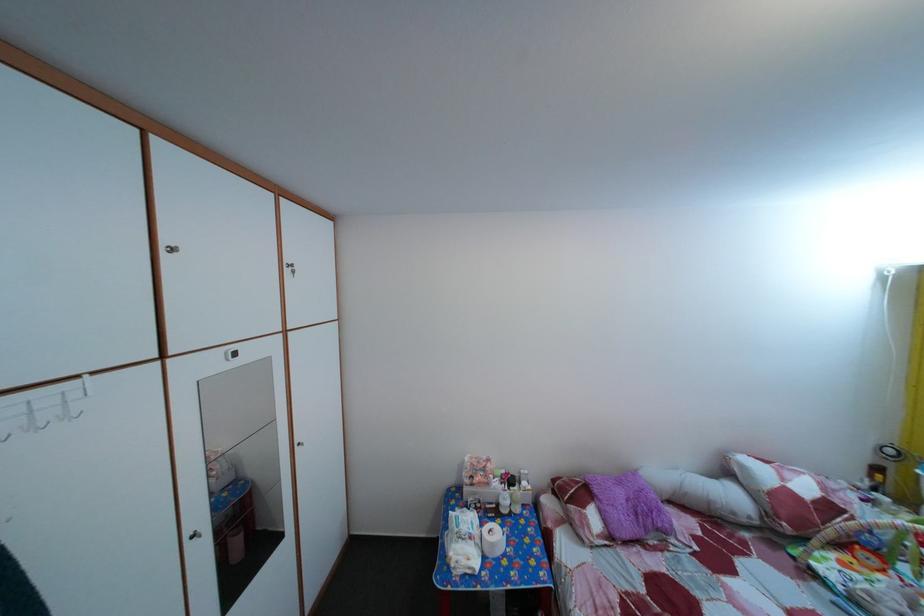
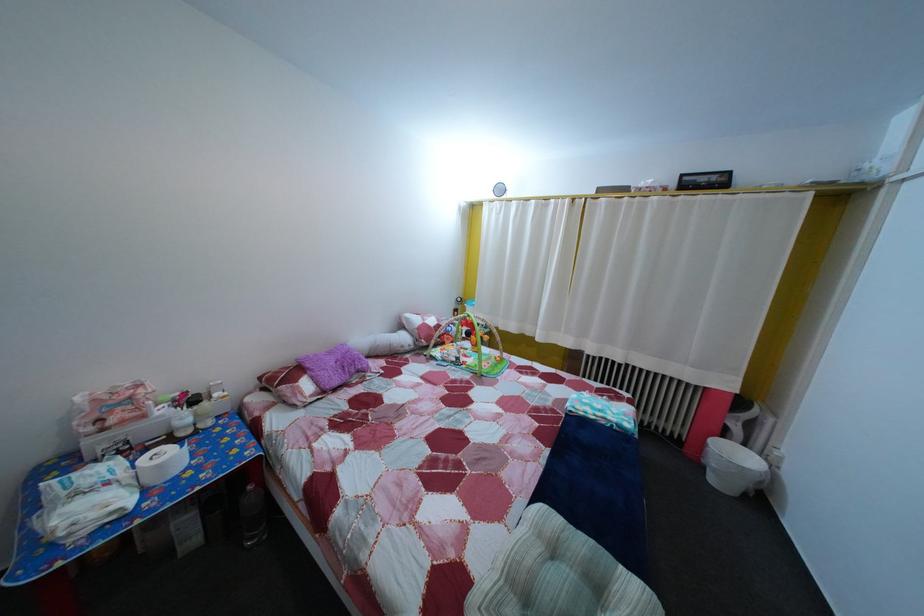
Question: The first image is from the beginning of the video and the second image is from the end. How did the camera likely rotate when shooting the video?

Choices:
 (A) Left
 (B) Right
 (C) Up
 (D) Down

Answer: (B)